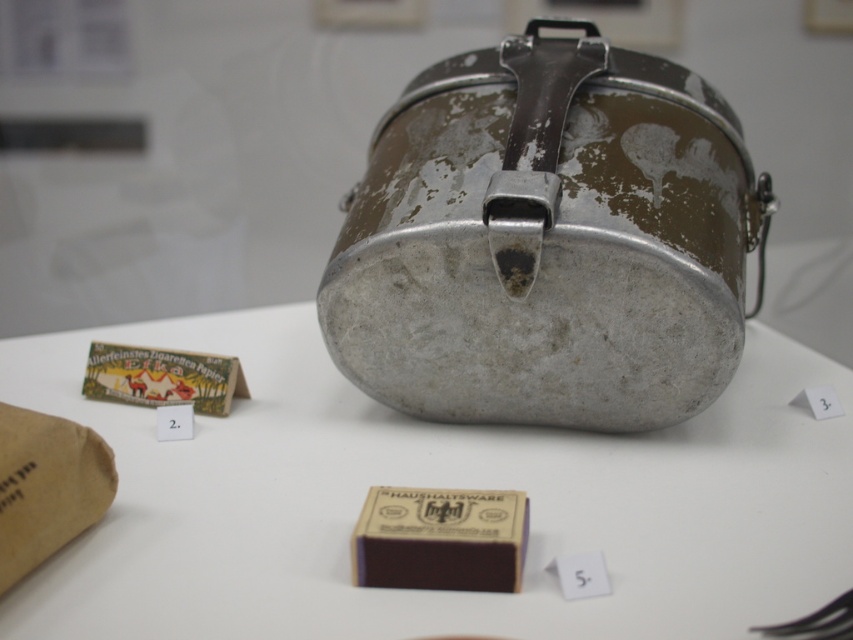
Looking at this image, does metallic silver container at center have a smaller size compared to dirty metallic lunchbox at center?

Incorrect, metallic silver container at center is not smaller in size than dirty metallic lunchbox at center.

Does metallic silver container at center appear on the left side of dirty metallic lunchbox at center?

Yes, metallic silver container at center is to the left of dirty metallic lunchbox at center.

Between point (184, 596) and point (619, 310), which one is positioned behind?

The point (619, 310) is more distant.

You are a GUI agent. You are given a task and a screenshot of the screen. Output one action in this format:
    pyautogui.click(x=<x>, y=<y>)
    Task: Click on the metallic silver container at center
    
    Given the screenshot: What is the action you would take?
    pyautogui.click(x=433, y=486)

Does dirty metallic lunchbox at center lie in front of brown paper bag at lower left?

No, it is behind brown paper bag at lower left.

Which is in front, point (477, 122) or point (51, 477)?

Point (51, 477)

Where is `dirty metallic lunchbox at center`? The image size is (853, 640). dirty metallic lunchbox at center is located at coordinates (547, 241).

Does metallic silver container at center appear over brown paper bag at lower left?

Yes.

Does point (289, 632) come closer to viewer compared to point (107, 451)?

Yes, it is in front of point (107, 451).

Is point (10, 628) closer to camera compared to point (62, 429)?

Yes, point (10, 628) is closer to viewer.

This screenshot has height=640, width=853. I want to click on metallic silver container at center, so pos(433,486).